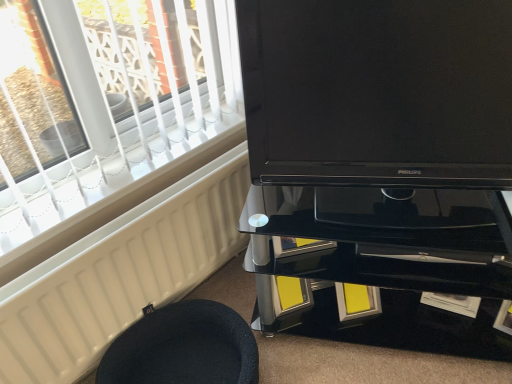
Where is `empty space that is ontop of black glass tv cabinet at center (from a real-world perspective)`? Image resolution: width=512 pixels, height=384 pixels. empty space that is ontop of black glass tv cabinet at center (from a real-world perspective) is located at coordinates (406, 210).